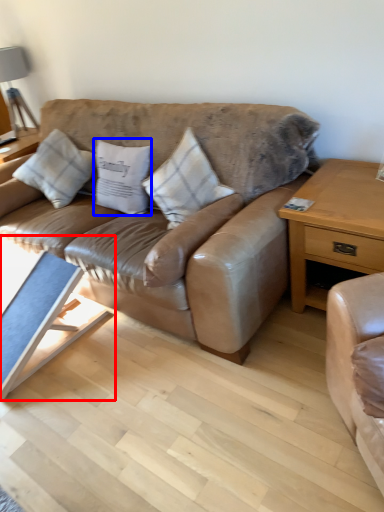
Question: Among these objects, which one is nearest to the camera, coffee table (highlighted by a red box) or pillow (highlighted by a blue box)?

Choices:
 (A) coffee table
 (B) pillow

Answer: (A)